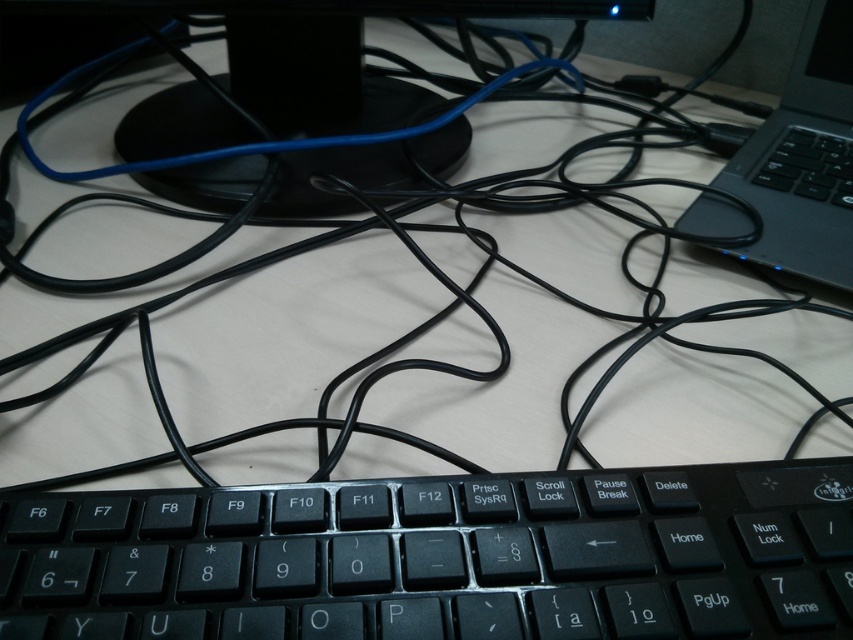
Question: Can you confirm if black matte keyboard at center is thinner than black plastic monitor at upper center?

Choices:
 (A) yes
 (B) no

Answer: (A)

Question: Which point is farther to the camera?

Choices:
 (A) (733, 634)
 (B) (851, 234)

Answer: (B)

Question: Which object is positioned farthest from the black plastic monitor at upper center?

Choices:
 (A) black matte keyboard at center
 (B) black plastic laptop at right

Answer: (A)

Question: Which object is farther from the camera taking this photo?

Choices:
 (A) black plastic laptop at right
 (B) black plastic monitor at upper center
 (C) black matte keyboard at center

Answer: (B)

Question: Is black plastic monitor at upper center to the left of black plastic laptop at right from the viewer's perspective?

Choices:
 (A) no
 (B) yes

Answer: (B)

Question: Does black matte keyboard at center lie behind black plastic monitor at upper center?

Choices:
 (A) no
 (B) yes

Answer: (A)